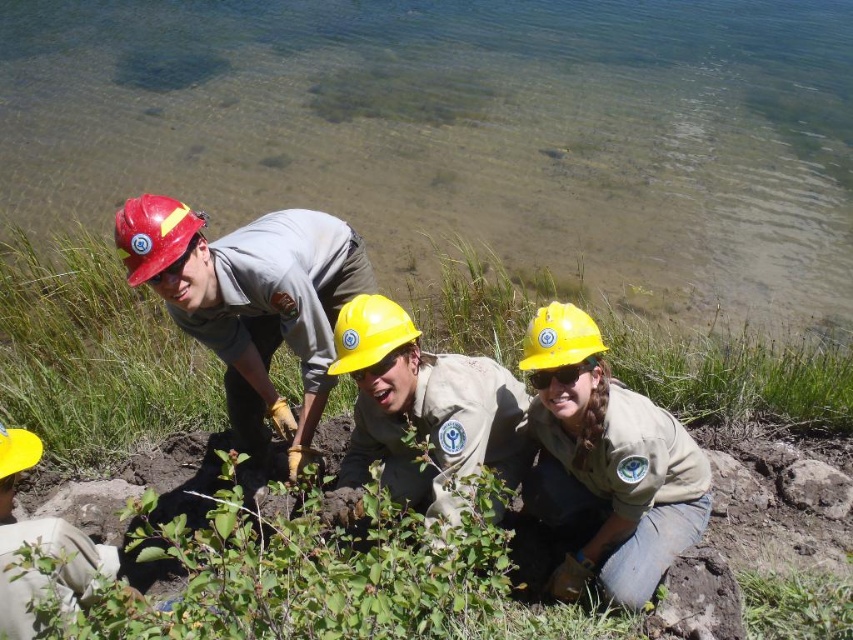
Is matte gray uniform at center bigger than green leafy plant at lower center?

Actually, matte gray uniform at center might be smaller than green leafy plant at lower center.

Does matte gray uniform at center have a lesser width compared to green leafy plant at lower center?

Indeed, matte gray uniform at center has a lesser width compared to green leafy plant at lower center.

You are a GUI agent. You are given a task and a screenshot of the screen. Output one action in this format:
    pyautogui.click(x=<x>, y=<y>)
    Task: Click on the matte gray uniform at center
    
    Given the screenshot: What is the action you would take?
    pyautogui.click(x=251, y=304)

The image size is (853, 640). What do you see at coordinates (39, 545) in the screenshot?
I see `yellow matte helmet at lower left` at bounding box center [39, 545].

Does yellow matte helmet at lower left have a smaller size compared to yellow hard hat at center?

Actually, yellow matte helmet at lower left might be larger than yellow hard hat at center.

Is point (28, 634) less distant than point (341, 333)?

Yes, point (28, 634) is in front of point (341, 333).

Identify the location of yellow matte helmet at lower left. This screenshot has height=640, width=853. (39, 545).

Can you confirm if green leafy plant at lower center is bigger than yellow hard hat at center?

Correct, green leafy plant at lower center is larger in size than yellow hard hat at center.

Is point (828, 397) positioned in front of point (358, 339)?

No.

The image size is (853, 640). I want to click on green leafy plant at lower center, so click(645, 348).